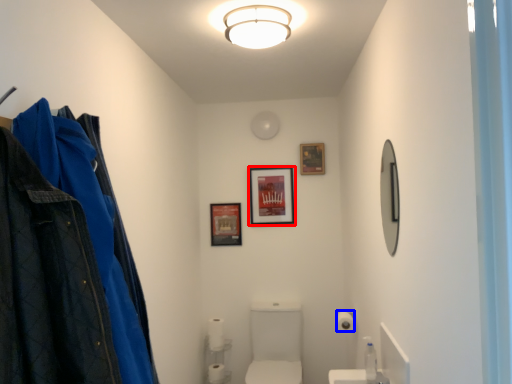
Question: Among these objects, which one is farthest to the camera, picture frame (highlighted by a red box) or toilet paper (highlighted by a blue box)?

Choices:
 (A) picture frame
 (B) toilet paper

Answer: (A)